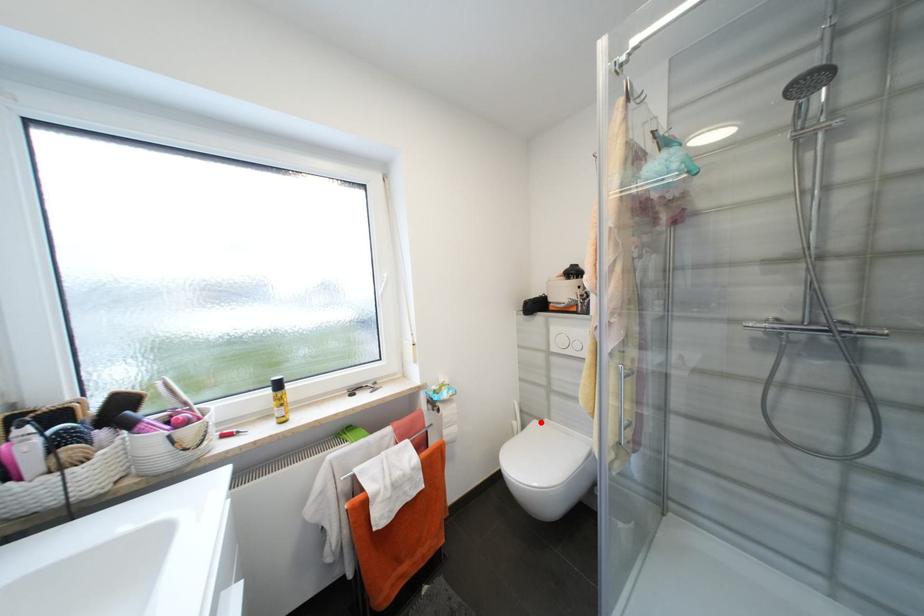
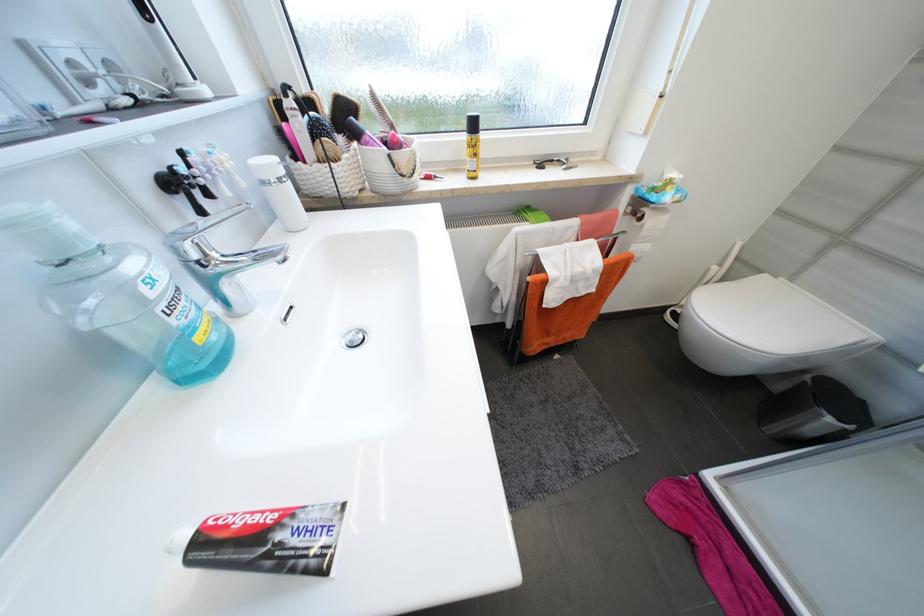
Locate, in the second image, the point that corresponds to the highlighted location in the first image.

(771, 277)